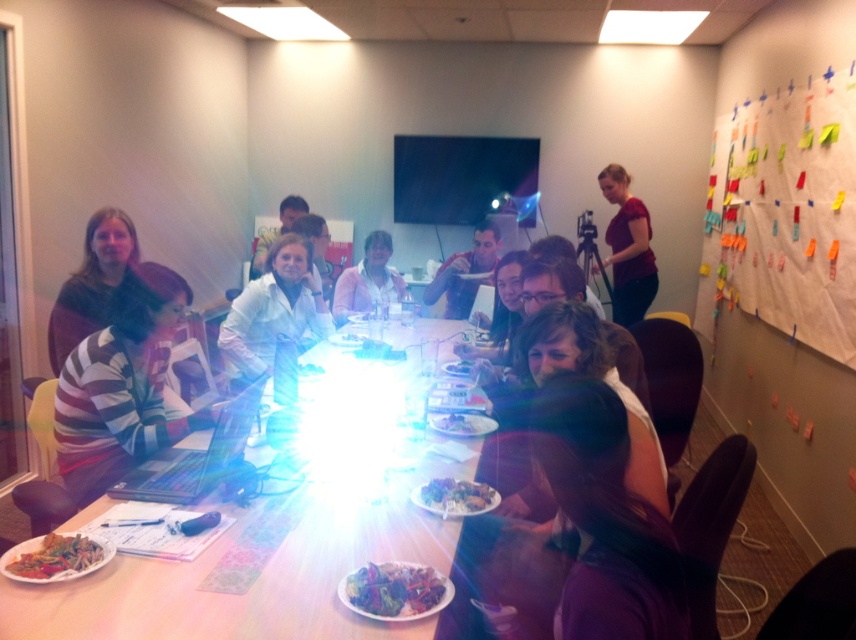
Question: Estimate the real-world distances between objects in this image. Which object is farther from the striped sweater at left?

Choices:
 (A) matte red shirt at upper right
 (B) colorful paper notes at upper right
 (C) matte white shirt at center

Answer: (B)

Question: Among these objects, which one is farthest from the camera?

Choices:
 (A) wooden table at center
 (B) matte white shirt at center
 (C) white glossy plate at center

Answer: (B)

Question: Which object appears closest to the camera in this image?

Choices:
 (A) shiny plastic plate at lower left
 (B) matte red shirt at upper right
 (C) striped sweater at left
 (D) shiny green leafy salad at center

Answer: (D)

Question: Where is pink matte jacket at center located in relation to matte white plate at center in the image?

Choices:
 (A) right
 (B) left

Answer: (B)

Question: Does shiny green leafy salad at center appear on the right side of shiny plastic plate at lower left?

Choices:
 (A) no
 (B) yes

Answer: (B)

Question: Can you confirm if white matte shirt at center is bigger than shiny green leafy salad at center?

Choices:
 (A) no
 (B) yes

Answer: (B)